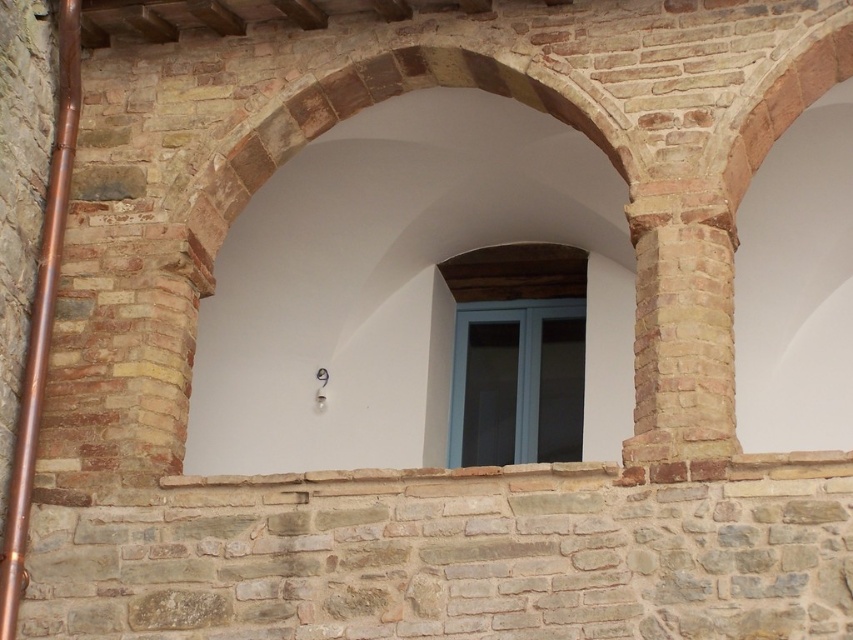
You are standing in front of a building and notice the smooth stone arch at center and the blue glass window at center. Which object is nearer to you?

The smooth stone arch at center is closer to the viewer than the blue glass window at center.

You are standing in front of the building and notice the brown brick column at right and the blue glass window at center. Which object is positioned to the right side of the other?

The brown brick column at right is to the right of the blue glass window at center.